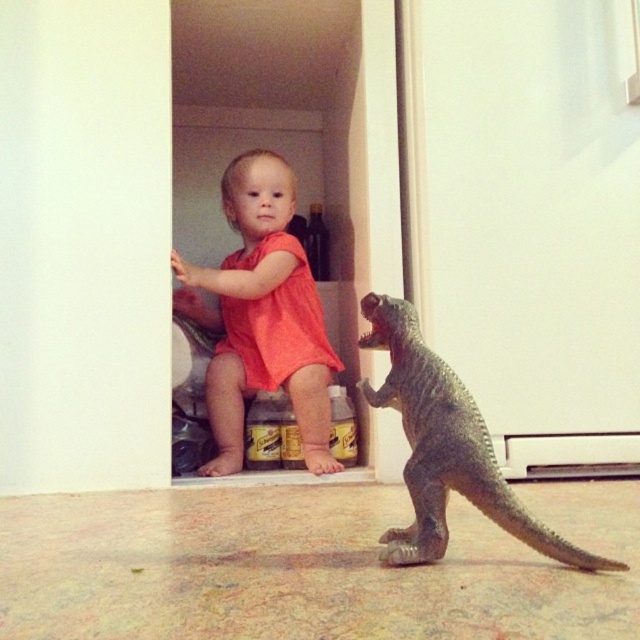
Image resolution: width=640 pixels, height=640 pixels. What are the coordinates of `matte orange romper at center` in the screenshot? It's located at (260, 316).

Does point (296, 330) lie behind point (392, 369)?

Yes, point (296, 330) is behind point (392, 369).

Which is behind, point (280, 376) or point (515, 500)?

Positioned behind is point (280, 376).

Where is `matte orange romper at center`? Image resolution: width=640 pixels, height=640 pixels. matte orange romper at center is located at coordinates (260, 316).